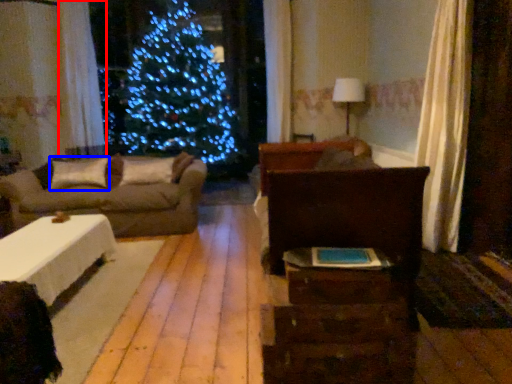
Question: Which object is closer to the camera taking this photo, curtain (highlighted by a red box) or pillow (highlighted by a blue box)?

Choices:
 (A) curtain
 (B) pillow

Answer: (B)